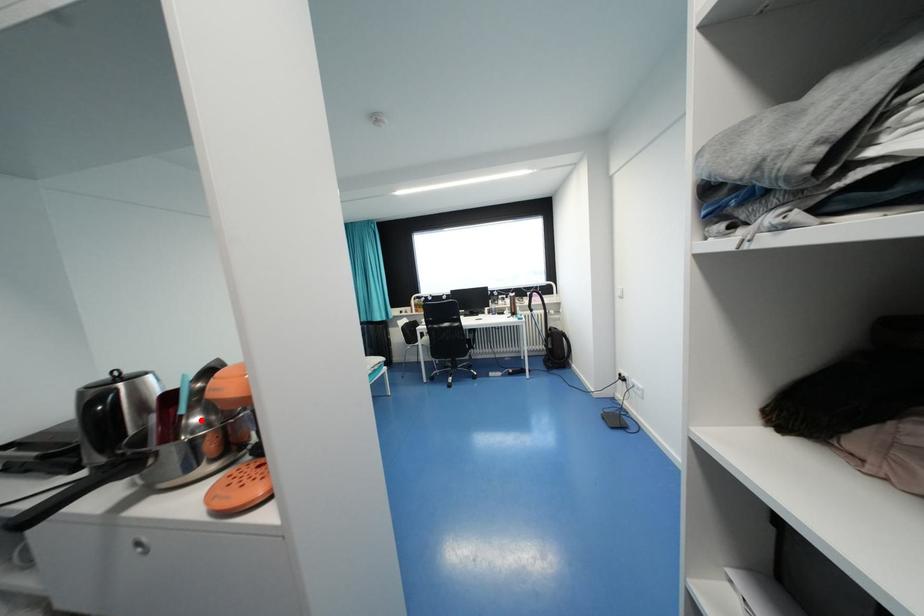
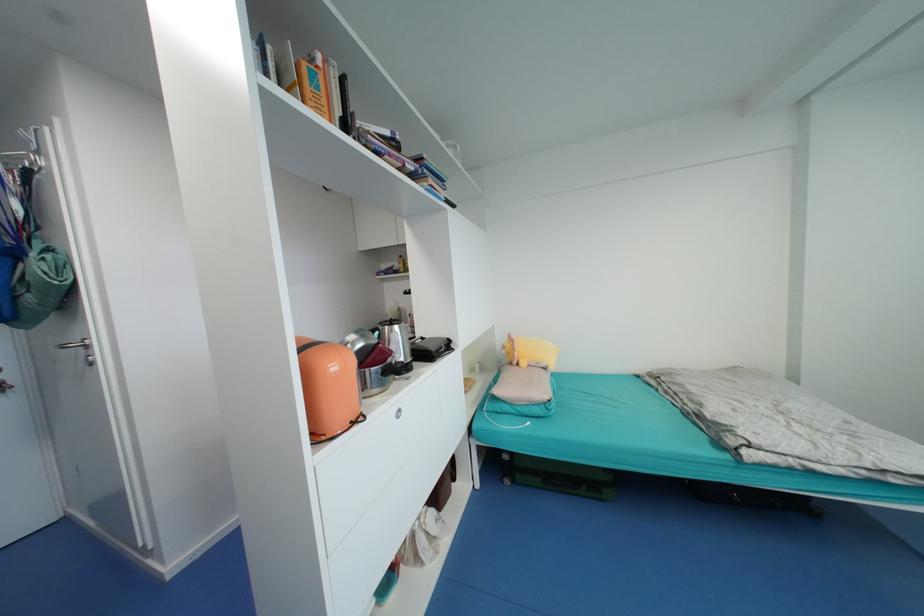
Question: I am providing you with two images of the same scene from different viewpoints. A red point is marked on the first image. Is the red point's position out of view in image 2?

Choices:
 (A) Yes
 (B) No

Answer: (A)